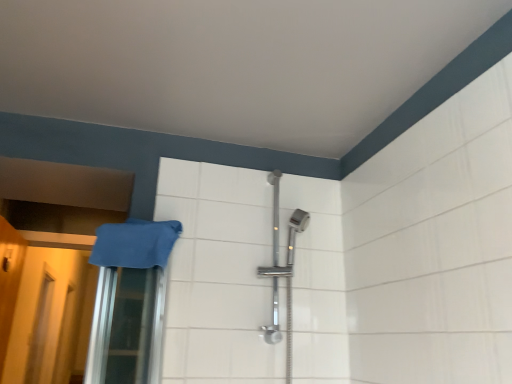
Question: From a real-world perspective, is blue fabric towel at left below translucent plastic screen door at lower left, which is counted as the second screen door, starting from the front?

Choices:
 (A) yes
 (B) no

Answer: (B)

Question: Is translucent plastic screen door at lower left, which is the 1th screen door from left to right, at the back of blue fabric towel at left?

Choices:
 (A) no
 (B) yes

Answer: (A)

Question: Considering the relative sizes of blue fabric towel at left and translucent plastic screen door at lower left, acting as the 2th screen door starting from the right, in the image provided, is blue fabric towel at left taller than translucent plastic screen door at lower left, acting as the 2th screen door starting from the right,?

Choices:
 (A) yes
 (B) no

Answer: (B)

Question: Does blue fabric towel at left appear on the right side of translucent plastic screen door at lower left, the 1th screen door viewed from the back?

Choices:
 (A) no
 (B) yes

Answer: (B)

Question: Is blue fabric towel at left thinner than translucent plastic screen door at lower left, the 1th screen door viewed from the back?

Choices:
 (A) no
 (B) yes

Answer: (A)

Question: Can you confirm if blue fabric towel at left is smaller than translucent plastic screen door at lower left, which is the 1th screen door from left to right?

Choices:
 (A) yes
 (B) no

Answer: (A)

Question: From the image's perspective, would you say translucent plastic screen door at lower left, the second screen door in the left-to-right sequence, is shown under yellow matte door at left?

Choices:
 (A) yes
 (B) no

Answer: (A)

Question: Considering the relative sizes of translucent plastic screen door at lower left, marked as the 2th screen door in a back-to-front arrangement, and yellow matte door at left in the image provided, is translucent plastic screen door at lower left, marked as the 2th screen door in a back-to-front arrangement, smaller than yellow matte door at left?

Choices:
 (A) yes
 (B) no

Answer: (A)

Question: Could you tell me if translucent plastic screen door at lower left, marked as the 2th screen door in a back-to-front arrangement, is turned towards yellow matte door at left?

Choices:
 (A) yes
 (B) no

Answer: (A)

Question: Is translucent plastic screen door at lower left, the 1th screen door when ordered from front to back, at the right side of yellow matte door at left?

Choices:
 (A) yes
 (B) no

Answer: (A)

Question: Considering the relative sizes of translucent plastic screen door at lower left, the first screen door when ordered from right to left, and yellow matte door at left in the image provided, is translucent plastic screen door at lower left, the first screen door when ordered from right to left, shorter than yellow matte door at left?

Choices:
 (A) yes
 (B) no

Answer: (B)

Question: Could you tell me if yellow matte door at left is facing translucent plastic screen door at lower left, acting as the 2th screen door starting from the right?

Choices:
 (A) yes
 (B) no

Answer: (B)